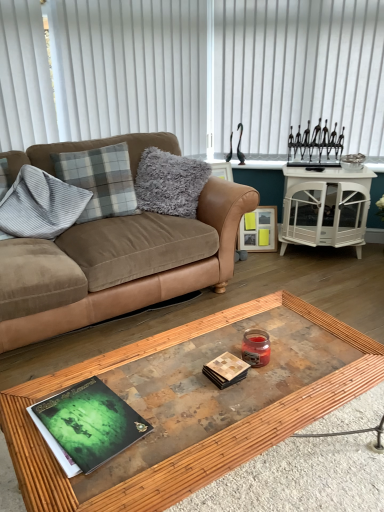
Find the location of `vacant area that lies to the right of green matte magazine at center, marked as the first magazine in a right-to-left arrangement`. vacant area that lies to the right of green matte magazine at center, marked as the first magazine in a right-to-left arrangement is located at coordinates (290, 380).